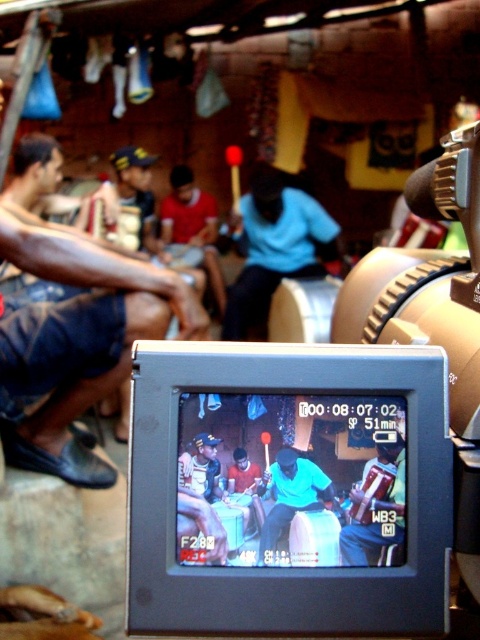
Question: Which point is farther from the camera taking this photo?

Choices:
 (A) (74, 326)
 (B) (351, 496)
 (C) (190, 397)
 (D) (276, 518)

Answer: (A)

Question: Is matte black video camera at center below dark blue denim shorts at left?

Choices:
 (A) yes
 (B) no

Answer: (A)

Question: Which point is closer to the camera?

Choices:
 (A) (129, 300)
 (B) (369, 525)
 (C) (168, 353)

Answer: (C)

Question: Among these points, which one is nearest to the camera?

Choices:
 (A) (302, 500)
 (B) (300, 259)
 (C) (379, 556)

Answer: (A)

Question: Is matte black video camera at center below blue fabric at center?

Choices:
 (A) no
 (B) yes

Answer: (A)

Question: Is matte black video camera at center to the left of blue fabric at center from the viewer's perspective?

Choices:
 (A) yes
 (B) no

Answer: (B)